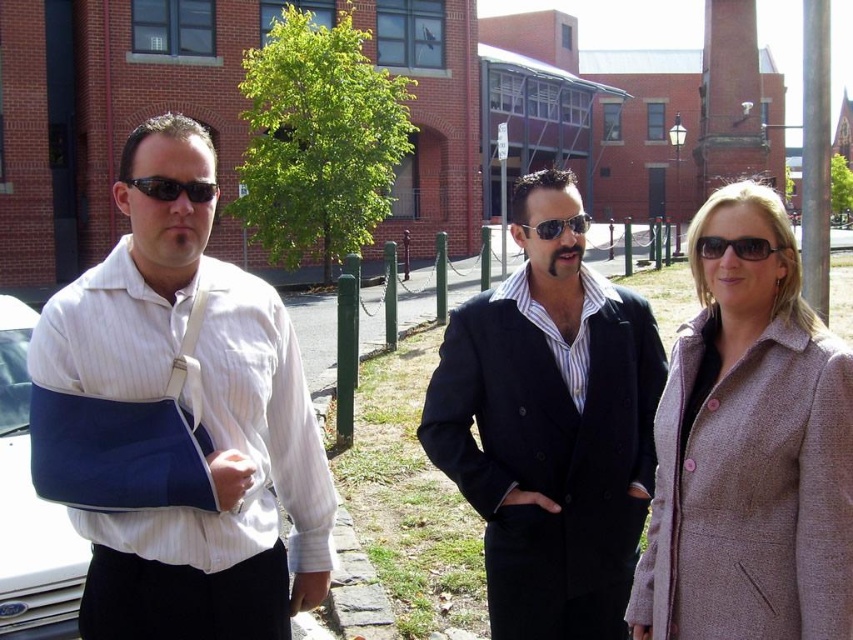
You are a pedestrian standing on the paved walkway near the brick building. You see a point marked at coordinates (x=30, y=508). What object does this point correspond to?

The point at (x=30, y=508) corresponds to the blue fabric arm at left.

From the picture: You are a photographer trying to capture a candid shot of the group. You notice the blue fabric arm sling at left and the black plastic sunglasses at center. Which object should you avoid blocking to ensure the subject remains visible?

The blue fabric arm sling at left is located below the black plastic sunglasses at center. To ensure the subject remains visible, avoid blocking the black plastic sunglasses at center as it is positioned higher and closer to the face.